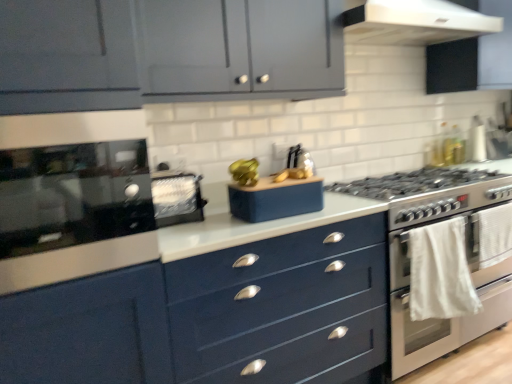
Question: From a real-world perspective, is navy blue drawer at center under white glossy range hood at upper center?

Choices:
 (A) no
 (B) yes

Answer: (B)

Question: Is white glossy range hood at upper center located within navy blue drawer at center?

Choices:
 (A) no
 (B) yes

Answer: (A)

Question: Is navy blue drawer at center outside of white glossy range hood at upper center?

Choices:
 (A) no
 (B) yes

Answer: (B)

Question: Considering the relative positions of navy blue drawer at center and white glossy range hood at upper center in the image provided, is navy blue drawer at center to the right of white glossy range hood at upper center from the viewer's perspective?

Choices:
 (A) no
 (B) yes

Answer: (A)

Question: Considering the relative sizes of navy blue drawer at center and white glossy range hood at upper center in the image provided, is navy blue drawer at center bigger than white glossy range hood at upper center?

Choices:
 (A) no
 (B) yes

Answer: (B)

Question: Is the position of navy blue drawer at center more distant than that of white glossy range hood at upper center?

Choices:
 (A) yes
 (B) no

Answer: (B)

Question: Can you confirm if satin black toaster at upper left, which is the 1th appliance in left-to-right order, is taller than matte blue speaker at center, marked as the 2th appliance in a left-to-right arrangement?

Choices:
 (A) yes
 (B) no

Answer: (A)

Question: Is satin black toaster at upper left, the 2th appliance viewed from the right, further to camera compared to matte blue speaker at center, marked as the 2th appliance in a left-to-right arrangement?

Choices:
 (A) yes
 (B) no

Answer: (B)

Question: Is satin black toaster at upper left, the 2th appliance viewed from the right, placed right next to matte blue speaker at center, marked as the 2th appliance in a left-to-right arrangement?

Choices:
 (A) yes
 (B) no

Answer: (B)

Question: Does satin black toaster at upper left, which is the 1th appliance in left-to-right order, have a smaller size compared to matte blue speaker at center, marked as the 1th appliance in a right-to-left arrangement?

Choices:
 (A) yes
 (B) no

Answer: (B)

Question: Is satin black toaster at upper left, the 2th appliance viewed from the right, oriented towards matte blue speaker at center, marked as the 2th appliance in a left-to-right arrangement?

Choices:
 (A) yes
 (B) no

Answer: (B)

Question: Can you confirm if satin black toaster at upper left, which is the 1th appliance in left-to-right order, is wider than matte blue speaker at center, marked as the 2th appliance in a left-to-right arrangement?

Choices:
 (A) no
 (B) yes

Answer: (B)

Question: From a real-world perspective, is glossy black oven at left located beneath matte blue speaker at center, marked as the 2th appliance in a left-to-right arrangement?

Choices:
 (A) yes
 (B) no

Answer: (B)